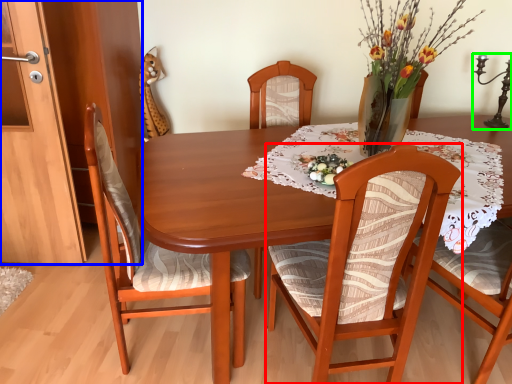
Question: Considering the real-world distances, which object is closest to chair (highlighted by a red box)? cabinetry (highlighted by a blue box) or candle holder (highlighted by a green box).

Choices:
 (A) cabinetry
 (B) candle holder

Answer: (A)